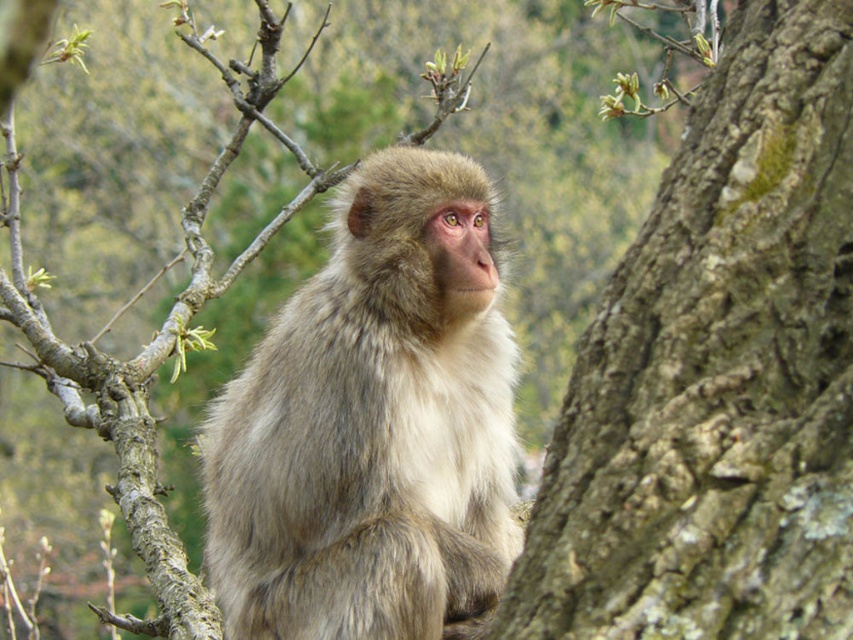
Who is shorter, brown rough bark at right or fuzzy fur monkey at center?

Standing shorter between the two is brown rough bark at right.

This screenshot has width=853, height=640. In order to click on brown rough bark at right in this screenshot , I will do `click(717, 372)`.